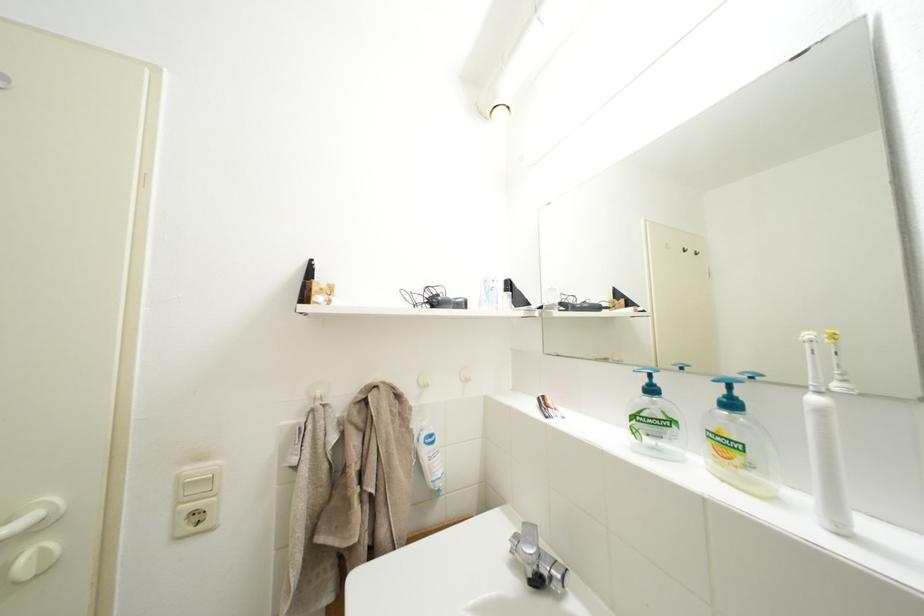
Image resolution: width=924 pixels, height=616 pixels. Describe the element at coordinates (195, 516) in the screenshot. I see `the electrical outlet` at that location.